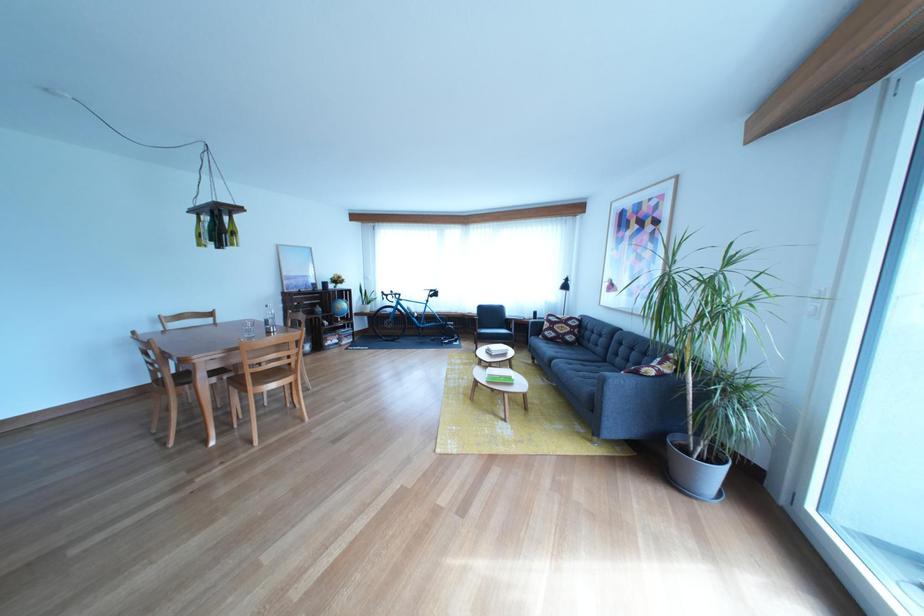
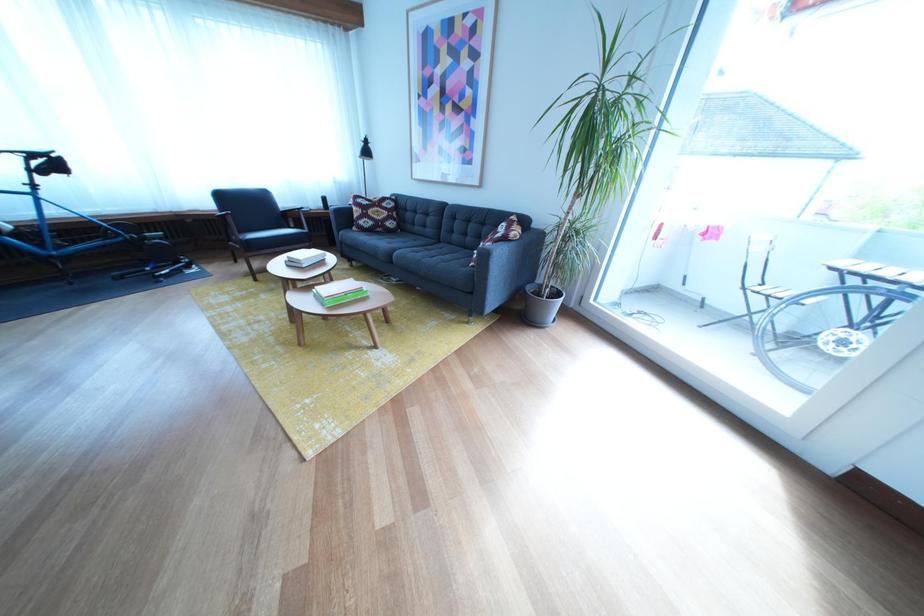
The first image is from the beginning of the video and the second image is from the end. How did the camera likely rotate when shooting the video?

The camera rotated toward right-down.